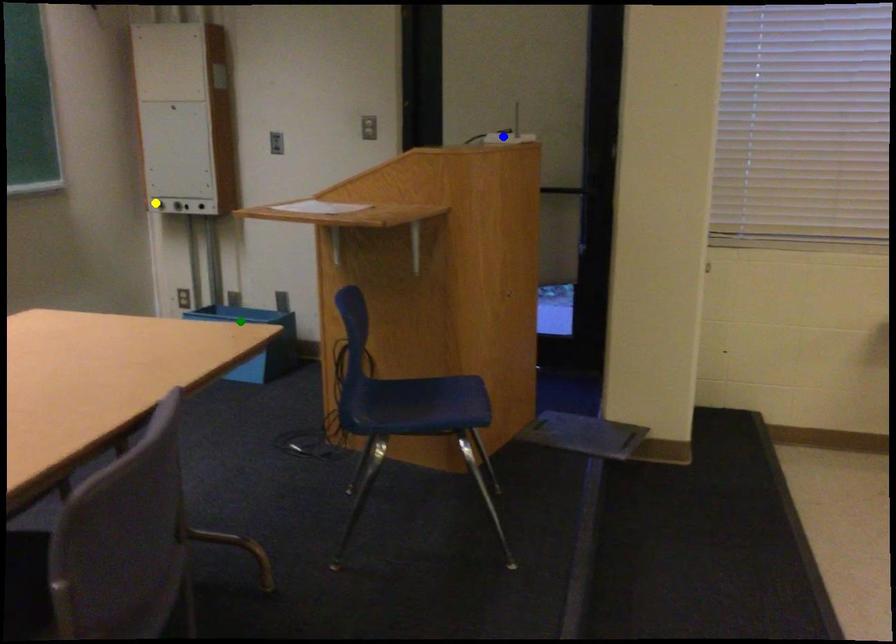
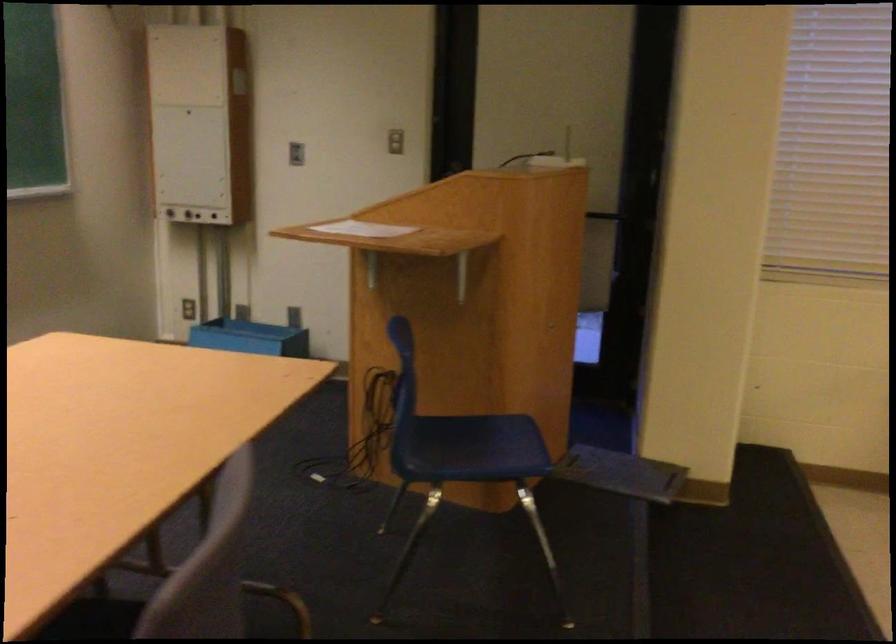
I am providing you with two images of the same scene from different viewpoints. Three points are marked in image1. Which point corresponds to a part or object that is occluded in image2?In image1, three points are marked. Which of them correspond to a part or object that is occluded in image2?Among the three points shown in image1, which one corresponds to a part or object that is no longer visible due to occlusion in image2?

Invisible in image2: blue point.